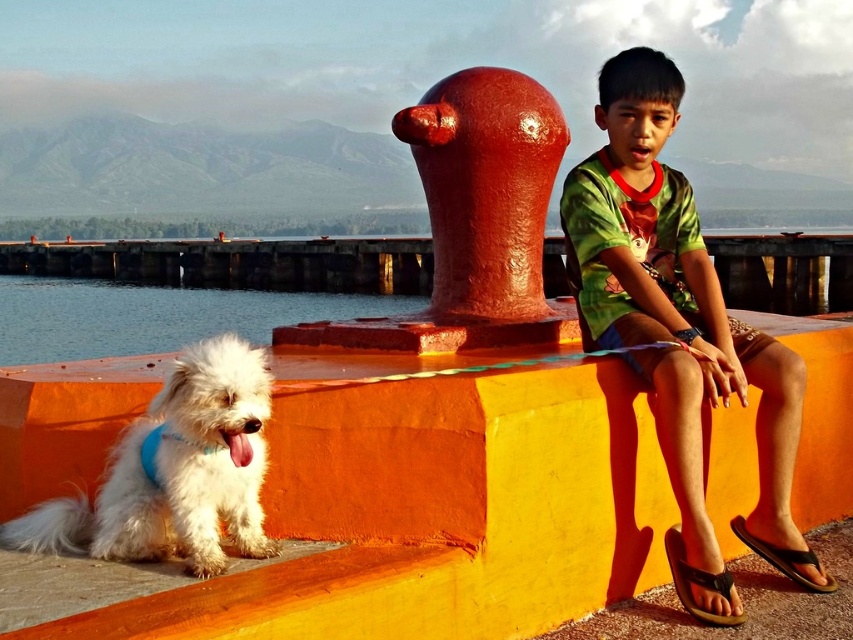
Based on the photo, is green fabric shirt at upper center shorter than clear water at lower left?

Correct, green fabric shirt at upper center is not as tall as clear water at lower left.

Is point (781, 552) positioned before point (33, 296)?

Yes, point (781, 552) is closer to viewer.

Based on the photo, who is more distant from viewer, [611,307] or [57,342]?

Positioned behind is point [57,342].

Image resolution: width=853 pixels, height=640 pixels. What are the coordinates of `green fabric shirt at upper center` in the screenshot? It's located at (679, 330).

This screenshot has width=853, height=640. Describe the element at coordinates (434, 504) in the screenshot. I see `orange matte ledge at lower center` at that location.

Which is below, orange matte ledge at lower center or clear water at lower left?

orange matte ledge at lower center is lower down.

Does point (469, 467) lie in front of point (4, 314)?

Yes, point (469, 467) is in front of point (4, 314).

Where is `orange matte ledge at lower center`? This screenshot has height=640, width=853. orange matte ledge at lower center is located at coordinates (434, 504).

What do you see at coordinates (434, 504) in the screenshot?
I see `orange matte ledge at lower center` at bounding box center [434, 504].

Is orange matte ledge at lower center to the left of white fluffy dog at lower left from the viewer's perspective?

In fact, orange matte ledge at lower center is to the right of white fluffy dog at lower left.

In order to click on orange matte ledge at lower center in this screenshot , I will do `click(434, 504)`.